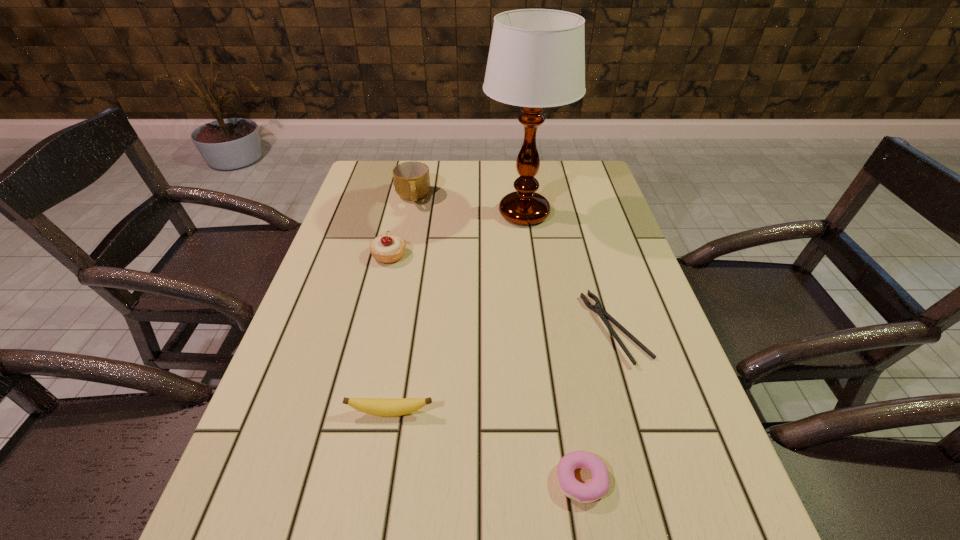
The height and width of the screenshot is (540, 960). Identify the location of the tallest object. (536, 59).

The image size is (960, 540). Find the location of `mug`. mug is located at coordinates (411, 179).

You are a GUI agent. You are given a task and a screenshot of the screen. Output one action in this format:
    pyautogui.click(x=<x>, y=<y>)
    Task: Click on the fourth shortest object
    
    Given the screenshot: What is the action you would take?
    pyautogui.click(x=386, y=248)

Identify the location of the taller pastry. Image resolution: width=960 pixels, height=540 pixels. (386, 248).

Locate an element on the screen. The image size is (960, 540). banana is located at coordinates (381, 407).

What are the coordinates of `the fifth farthest object` in the screenshot? It's located at (381, 407).

The width and height of the screenshot is (960, 540). Identify the location of the fifth tallest object. (589, 492).

What are the coordinates of `the shorter pastry` in the screenshot? It's located at (589, 492).

This screenshot has width=960, height=540. Find the location of `tongs`. tongs is located at coordinates (597, 308).

You are a GUI agent. You are given a task and a screenshot of the screen. Output one action in this format:
    pyautogui.click(x=<x>, y=<y>)
    Task: Click on the shortest object
    The image size is (960, 540).
    Given the screenshot: What is the action you would take?
    pyautogui.click(x=597, y=308)